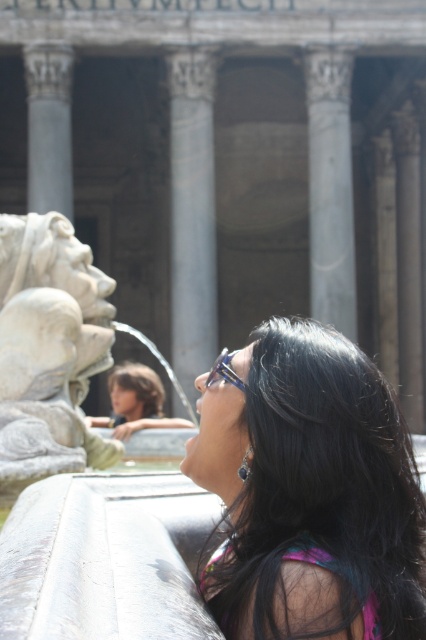
You are standing at the point labeled point (235, 381) and want to take a photo of the columns in the background. Is the point labeled point (184, 124) between you and the columns?

Yes, the point labeled point (184, 124) is between you and the columns because it is behind point (235, 381) where you are standing.

You are a tourist visiting the ancient Roman site and want to take a photo of the gray marble pillar at center and the shiny blue glasses at center. Which object should you zoom in on to capture both in the frame without cropping?

You should zoom in on the shiny blue glasses at center because the gray marble pillar at center is wider than the shiny blue glasses at center, making the glasses the smaller object and easier to fit in the frame without cropping both.